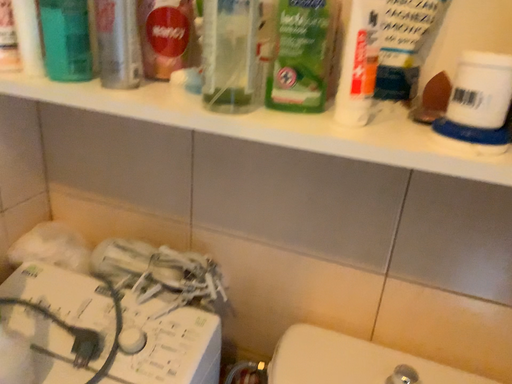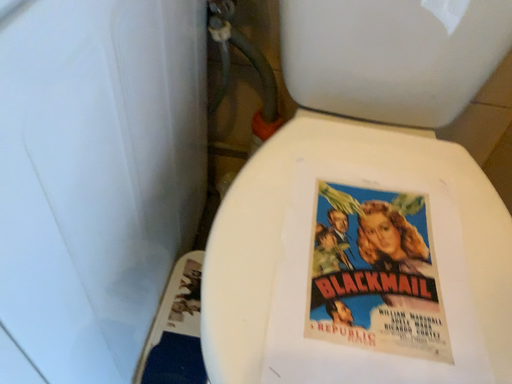
Question: Which way did the camera rotate in the video?

Choices:
 (A) rotated upward
 (B) rotated downward

Answer: (B)